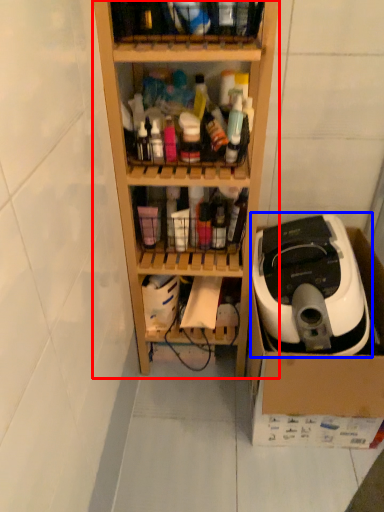
Question: Which object is closer to the camera taking this photo, shelf (highlighted by a red box) or home appliance (highlighted by a blue box)?

Choices:
 (A) shelf
 (B) home appliance

Answer: (A)